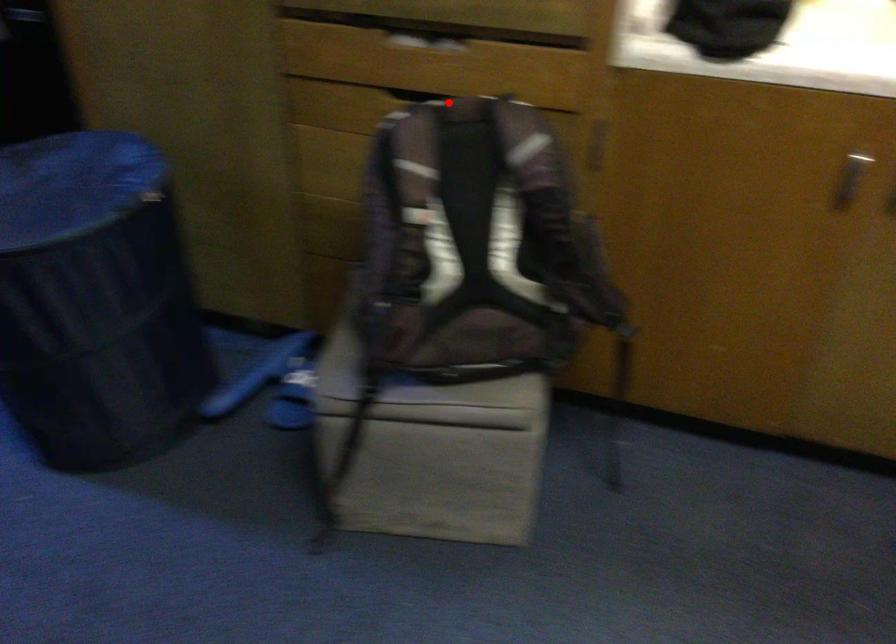
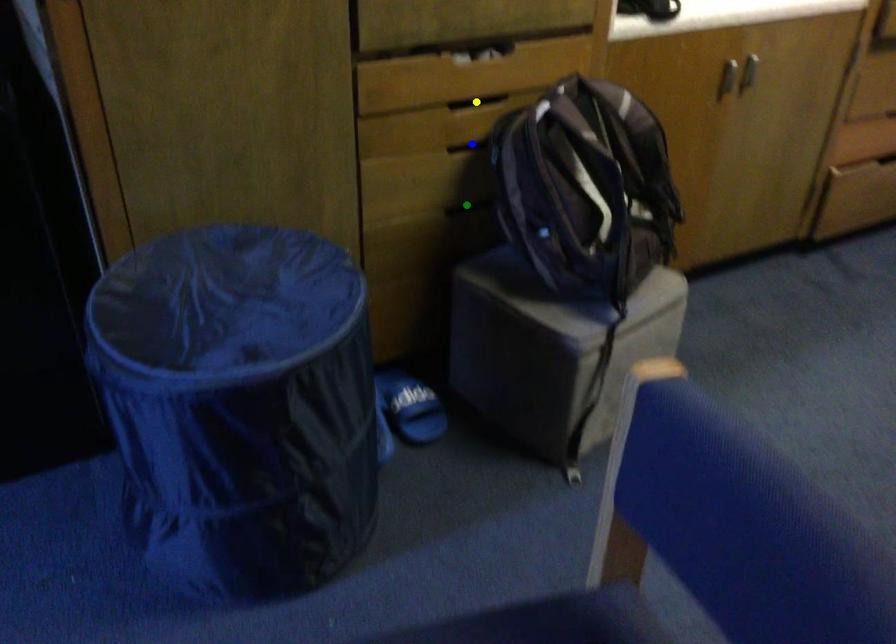
Question: I am providing you with two images of the same scene from different viewpoints. A red point is marked on the first image. You are given multiple points on the second image. In image 2, which mark is for the same physical point as the one in image 1?

Choices:
 (A) blue point
 (B) green point
 (C) yellow point

Answer: (C)